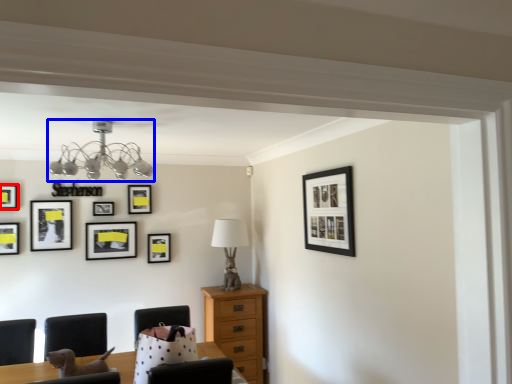
Question: Among these objects, which one is nearest to the camera, picture frame (highlighted by a red box) or lamp (highlighted by a blue box)?

Choices:
 (A) picture frame
 (B) lamp

Answer: (B)